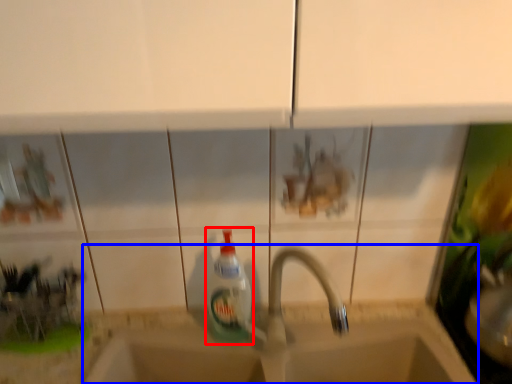
Question: Which object is closer to the camera taking this photo, bottle (highlighted by a red box) or sink (highlighted by a blue box)?

Choices:
 (A) bottle
 (B) sink

Answer: (A)